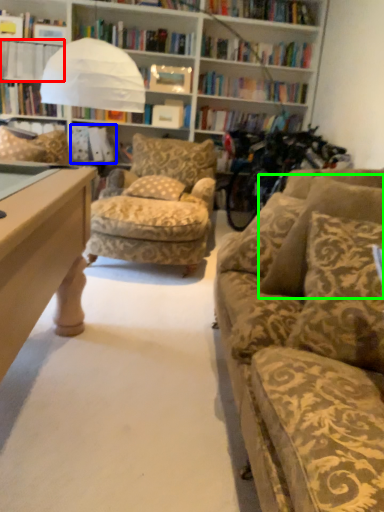
Question: Estimate the real-world distances between objects in this image. Which object is closer to book (highlighted by a red box), book (highlighted by a blue box) or pillow (highlighted by a green box)?

Choices:
 (A) book
 (B) pillow

Answer: (A)